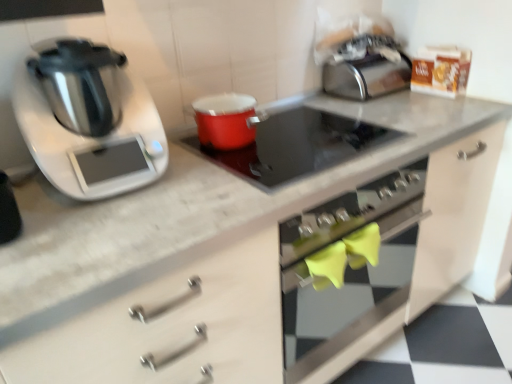
This screenshot has width=512, height=384. What are the coordinates of `free spot in front of satin silver toaster at upper right` in the screenshot? It's located at (372, 107).